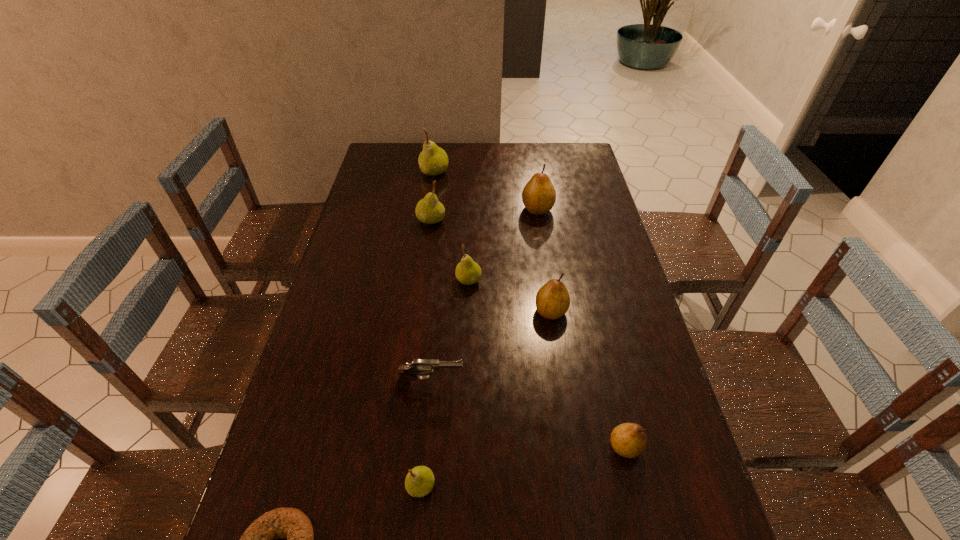
You are a GUI agent. You are given a task and a screenshot of the screen. Output one action in this format:
    pyautogui.click(x=<x>, y=<y>)
    Task: Click on the free space located 0.070m on the front of the rightmost pear
    
    Given the screenshot: What is the action you would take?
    pyautogui.click(x=637, y=497)

Identify the location of free space located 0.080m on the left of the eighth farthest object. Image resolution: width=960 pixels, height=540 pixels. (369, 486).

Identify the location of object that is positioned at the far edge. (433, 160).

You are a GUI agent. You are given a task and a screenshot of the screen. Output one action in this format:
    pyautogui.click(x=<x>, y=<y>)
    Task: Click on the object present at the right edge
    The height and width of the screenshot is (540, 960).
    Given the screenshot: What is the action you would take?
    pyautogui.click(x=629, y=440)

Find the location of `vacant space at the far edge of the desktop`. vacant space at the far edge of the desktop is located at coordinates (547, 166).

The width and height of the screenshot is (960, 540). Identify the location of free space at the left edge. (371, 296).

You are a GUI agent. You are given a task and a screenshot of the screen. Output one action in this format:
    pyautogui.click(x=<x>, y=<y>)
    Task: Click on the free space at the right edge
    The height and width of the screenshot is (540, 960).
    Given the screenshot: What is the action you would take?
    pyautogui.click(x=632, y=318)

In the image, there is a desktop. Identify the location of vacant area at the far right corner. Image resolution: width=960 pixels, height=540 pixels. [x=567, y=170].

Where is `unoccupied position between the fourth pear from right to left and the second biggest green pear`? This screenshot has width=960, height=540. unoccupied position between the fourth pear from right to left and the second biggest green pear is located at coordinates (450, 250).

Identify the location of free point between the third farthest green pear and the farthest pear. The image size is (960, 540). (451, 226).